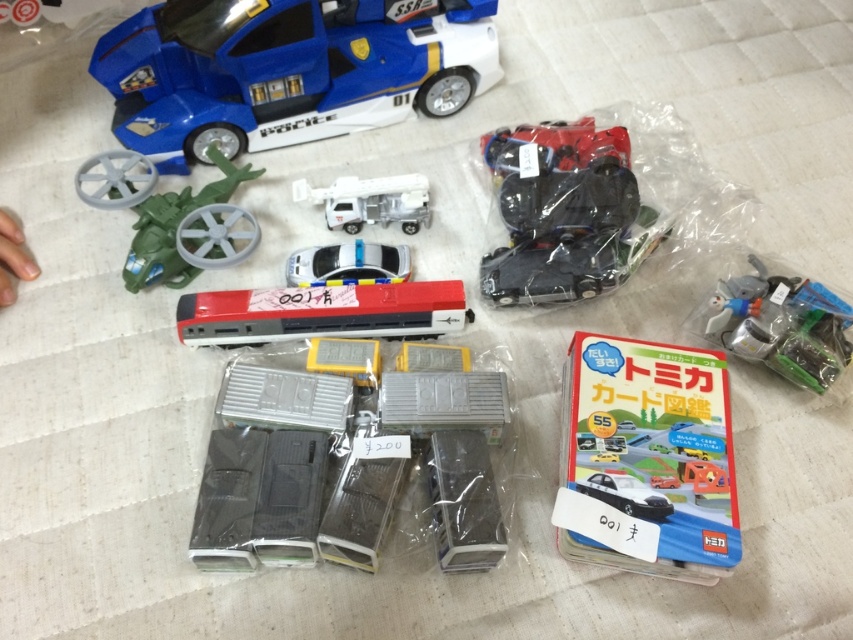
Between white glossy car at center and matte black car at center, which one appears on the left side from the viewer's perspective?

white glossy car at center is more to the left.

Is white glossy car at center positioned at the back of matte black car at center?

Yes, it is.

Find the location of a particular element. The height and width of the screenshot is (640, 853). white glossy car at center is located at coordinates (347, 262).

The width and height of the screenshot is (853, 640). Describe the element at coordinates (321, 312) in the screenshot. I see `matte red train at center` at that location.

Between matte red train at center and metallic silver toy at right, which one appears on the left side from the viewer's perspective?

From the viewer's perspective, matte red train at center appears more on the left side.

The width and height of the screenshot is (853, 640). What are the coordinates of `matte red train at center` in the screenshot? It's located at (321, 312).

The height and width of the screenshot is (640, 853). I want to click on matte red train at center, so click(x=321, y=312).

Is point (704, 433) positioned after point (606, 140)?

No, (704, 433) is closer to viewer.

From the picture: Can you confirm if matte plastic book at center is taller than matte red car at upper right?

Indeed, matte plastic book at center has a greater height compared to matte red car at upper right.

Image resolution: width=853 pixels, height=640 pixels. What are the coordinates of `matte plastic book at center` in the screenshot? It's located at (647, 460).